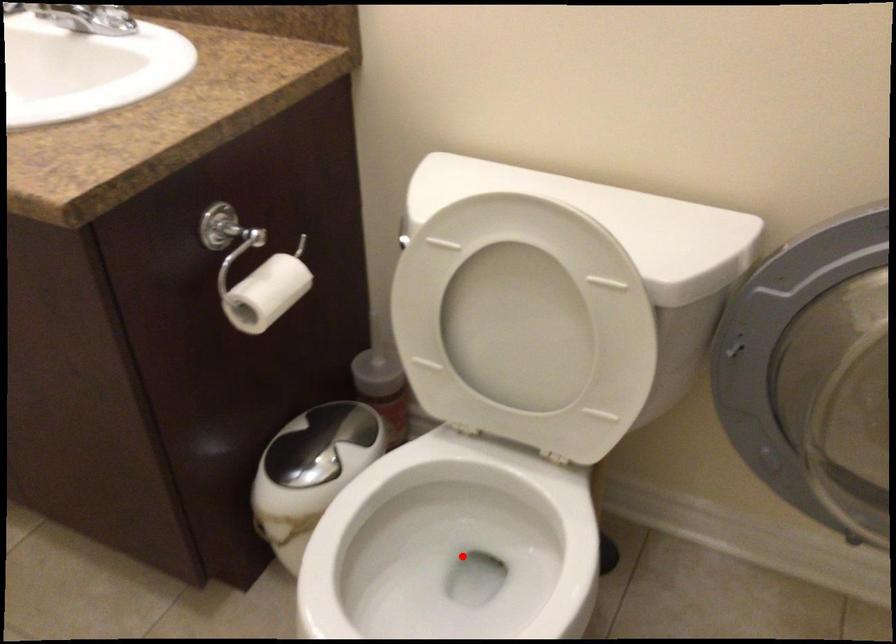
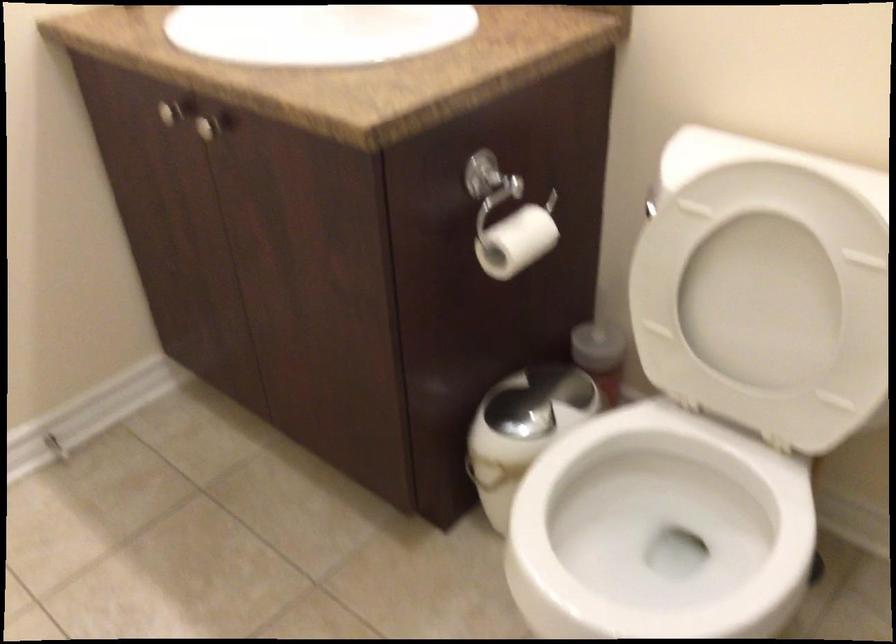
Locate, in the second image, the point that corresponds to the highlighted location in the first image.

(660, 524)